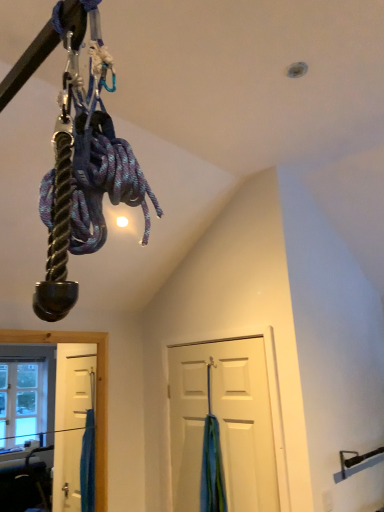
Question: Considering the positions of white matte door at center and blue fabric at door in the image, is white matte door at center taller or shorter than blue fabric at door?

Choices:
 (A) short
 (B) tall

Answer: (B)

Question: Considering the positions of point (226, 398) and point (226, 507), is point (226, 398) closer or farther from the camera than point (226, 507)?

Choices:
 (A) farther
 (B) closer

Answer: (A)

Question: Considering the relative positions of white matte door at center and blue fabric at door in the image provided, is white matte door at center to the left or to the right of blue fabric at door?

Choices:
 (A) right
 (B) left

Answer: (A)

Question: In terms of size, does blue fabric at door appear bigger or smaller than white matte door at center?

Choices:
 (A) big
 (B) small

Answer: (B)

Question: In terms of width, does blue fabric at door look wider or thinner when compared to white matte door at center?

Choices:
 (A) wide
 (B) thin

Answer: (A)

Question: In terms of height, does blue fabric at door look taller or shorter compared to white matte door at center?

Choices:
 (A) short
 (B) tall

Answer: (A)

Question: Considering their positions, is blue fabric at door located in front of or behind white matte door at center?

Choices:
 (A) behind
 (B) front

Answer: (A)